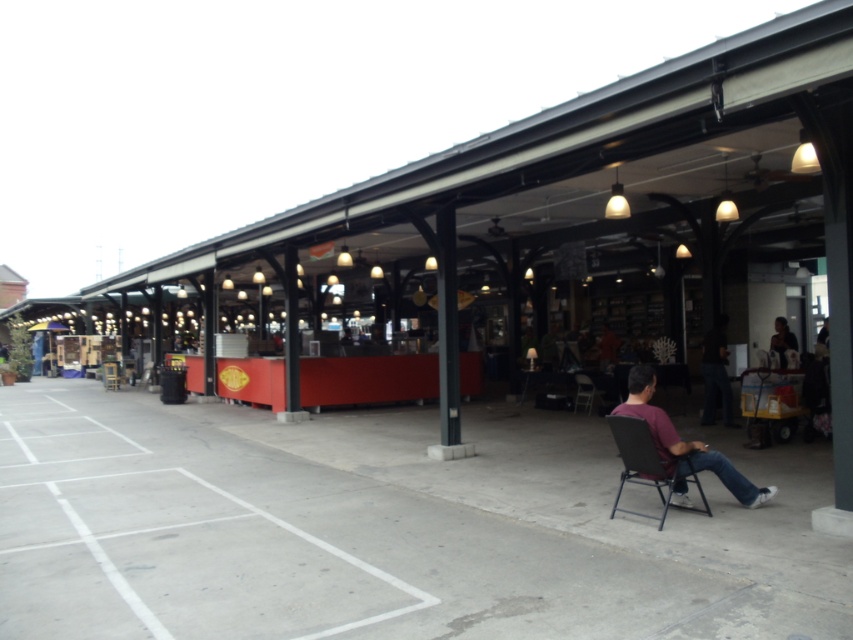
You are a person who wants to sit down in the market area. You see a dark brown fabric chair at lower right and a metallic gray folding chair at lower right. Which chair is taller?

The dark brown fabric chair at lower right is much taller than the metallic gray folding chair at lower right.

In the scene shown: You are a visitor at the market and want to sit down. You see a dark brown fabric chair at lower right and a metallic gray folding chair at lower right. Which chair is smaller?

The dark brown fabric chair at lower right is smaller than the metallic gray folding chair at lower right.